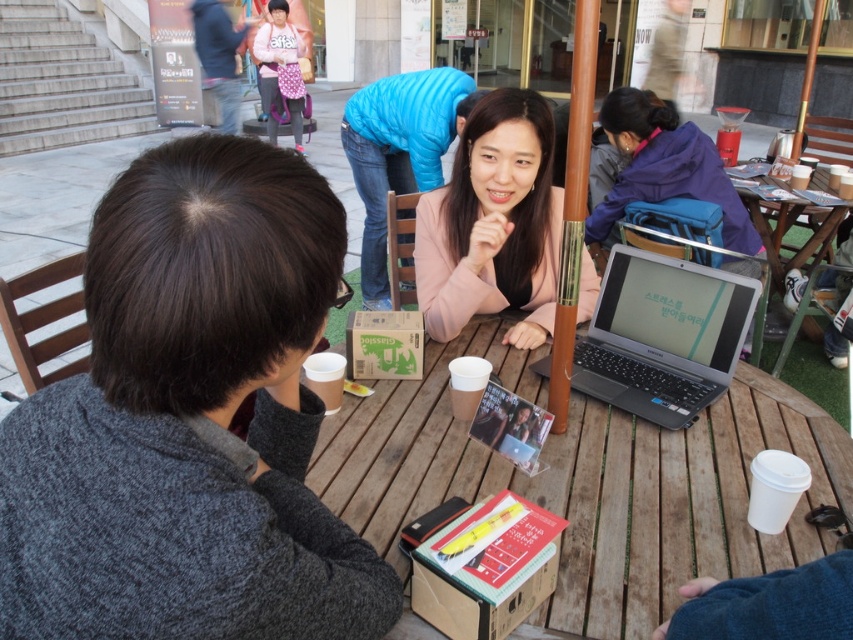
Question: Can you confirm if wooden table at center is positioned below pink matte jacket at center?

Choices:
 (A) yes
 (B) no

Answer: (A)

Question: Can you confirm if pink matte jacket at center is positioned below silver/black plastic laptop at center?

Choices:
 (A) yes
 (B) no

Answer: (B)

Question: Which object is positioned closest to the pink fabric bag at upper center?

Choices:
 (A) wooden table at center
 (B) dark gray sweater at upper left
 (C) pink matte jacket at center
 (D) wooden picnic table at right

Answer: (D)

Question: Among these objects, which one is farthest from the camera?

Choices:
 (A) wooden picnic table at right
 (B) dark gray sweater at upper left
 (C) wooden table at center
 (D) silver/black plastic laptop at center

Answer: (A)

Question: Is pink matte jacket at center smaller than silver/black plastic laptop at center?

Choices:
 (A) no
 (B) yes

Answer: (A)

Question: Which object is closer to the camera taking this photo?

Choices:
 (A) wooden picnic table at right
 (B) pink matte jacket at center
 (C) wooden table at center

Answer: (C)